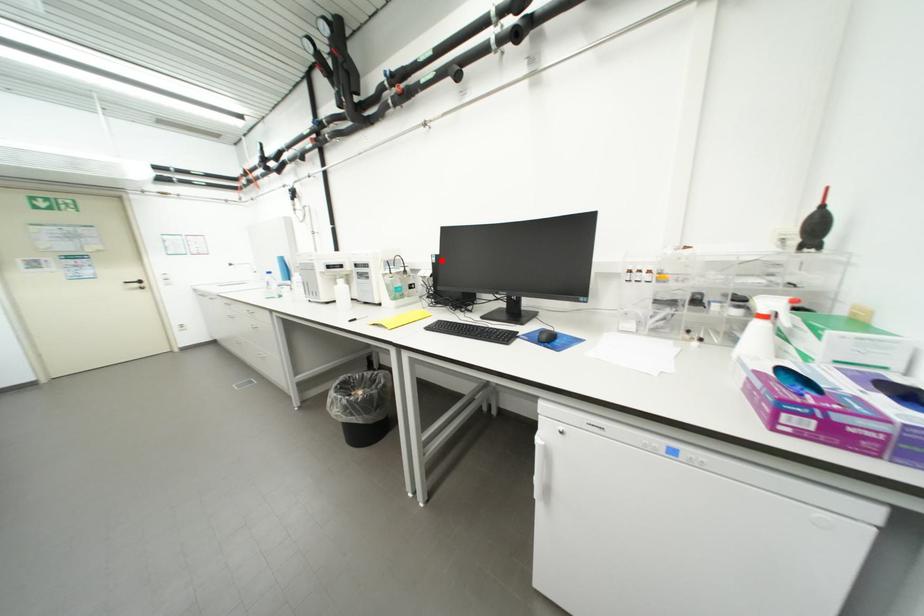
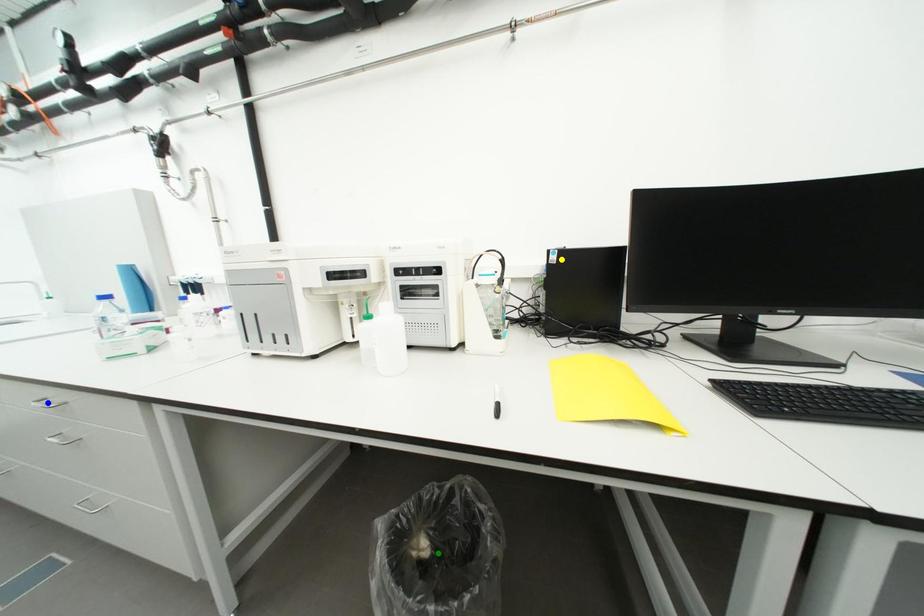
Question: I am providing you with two images of the same scene from different viewpoints. A red point is marked on the first image. You are given multiple points on the second image. Can you choose the point in image 2 that corresponds to the point in image 1?

Choices:
 (A) blue point
 (B) green point
 (C) yellow point

Answer: (C)